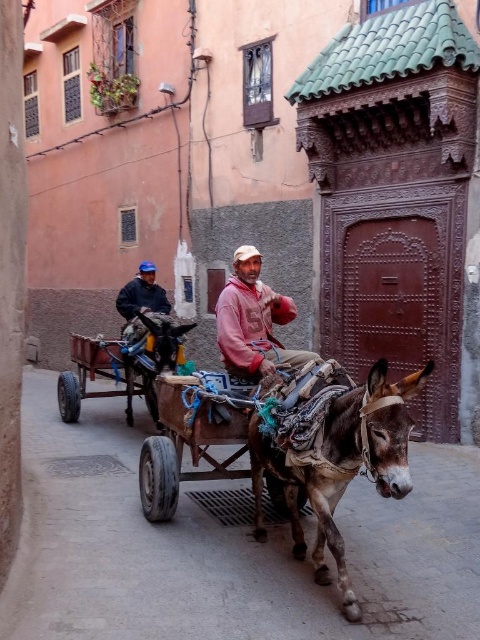
Consider the image. Which is more to the left, gray-brown textured mule at center or matte pink hoodie at center?

matte pink hoodie at center

Does gray-brown textured mule at center appear over matte pink hoodie at center?

No, gray-brown textured mule at center is not above matte pink hoodie at center.

Is point (317, 474) less distant than point (265, 300)?

Yes, point (317, 474) is in front of point (265, 300).

Where is `gray-brown textured mule at center`? Image resolution: width=480 pixels, height=640 pixels. gray-brown textured mule at center is located at coordinates (340, 465).

Can you confirm if gray-brown textured mule at center is positioned to the right of rustic wooden cart at center?

Indeed, gray-brown textured mule at center is positioned on the right side of rustic wooden cart at center.

Is point (348, 454) in front of point (204, 429)?

Yes, point (348, 454) is closer to viewer.

The image size is (480, 640). Find the location of `gray-brown textured mule at center`. gray-brown textured mule at center is located at coordinates (340, 465).

Consider the image. Who is shorter, rustic wooden cart at center or wooden cart at center?

rustic wooden cart at center is shorter.

Who is lower down, rustic wooden cart at center or wooden cart at center?

rustic wooden cart at center

Is point (149, 438) less distant than point (135, 314)?

That is True.

The image size is (480, 640). Identify the location of rustic wooden cart at center. (189, 444).